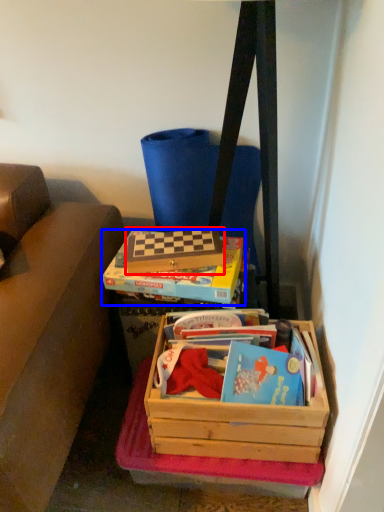
Question: Which point is further to the camera, box (highlighted by a red box) or box (highlighted by a blue box)?

Choices:
 (A) box
 (B) box

Answer: (A)